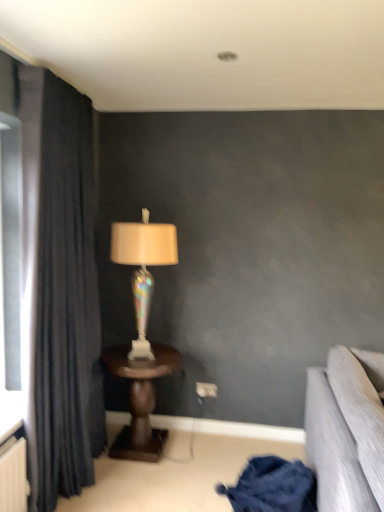
Question: Is iridescent glass lamp at center next to dark fabric curtain at left and touching it?

Choices:
 (A) yes
 (B) no

Answer: (B)

Question: Is iridescent glass lamp at center taller than dark fabric curtain at left?

Choices:
 (A) no
 (B) yes

Answer: (A)

Question: From the image's perspective, would you say iridescent glass lamp at center is shown under dark fabric curtain at left?

Choices:
 (A) yes
 (B) no

Answer: (B)

Question: Considering the relative sizes of iridescent glass lamp at center and dark fabric curtain at left in the image provided, is iridescent glass lamp at center wider than dark fabric curtain at left?

Choices:
 (A) no
 (B) yes

Answer: (B)

Question: From a real-world perspective, is iridescent glass lamp at center positioned over dark fabric curtain at left based on gravity?

Choices:
 (A) no
 (B) yes

Answer: (B)

Question: Would you say iridescent glass lamp at center contains dark fabric curtain at left?

Choices:
 (A) yes
 (B) no

Answer: (B)

Question: Considering the relative sizes of iridescent glass lamp at center and dark blue fabric at lower right in the image provided, is iridescent glass lamp at center shorter than dark blue fabric at lower right?

Choices:
 (A) yes
 (B) no

Answer: (B)

Question: Considering the relative positions of iridescent glass lamp at center and dark blue fabric at lower right in the image provided, is iridescent glass lamp at center to the left of dark blue fabric at lower right from the viewer's perspective?

Choices:
 (A) yes
 (B) no

Answer: (A)

Question: Is iridescent glass lamp at center taller than dark blue fabric at lower right?

Choices:
 (A) no
 (B) yes

Answer: (B)

Question: From a real-world perspective, is iridescent glass lamp at center located higher than dark blue fabric at lower right?

Choices:
 (A) no
 (B) yes

Answer: (B)

Question: Does iridescent glass lamp at center have a smaller size compared to dark blue fabric at lower right?

Choices:
 (A) yes
 (B) no

Answer: (B)

Question: Is iridescent glass lamp at center not inside dark blue fabric at lower right?

Choices:
 (A) no
 (B) yes

Answer: (B)

Question: Can you confirm if iridescent glass lamp at center is smaller than wooden table at center?

Choices:
 (A) yes
 (B) no

Answer: (A)